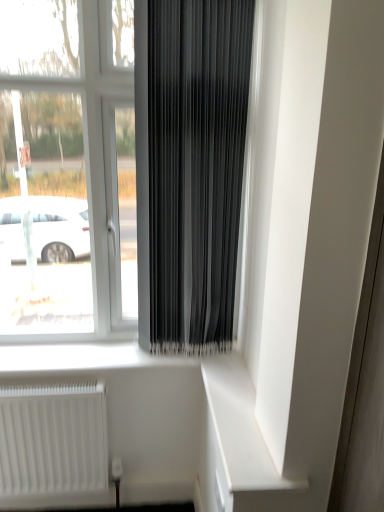
Question: Considering the positions of point (211, 51) and point (119, 224), is point (211, 51) closer or farther from the camera than point (119, 224)?

Choices:
 (A) closer
 (B) farther

Answer: (A)

Question: From their relative heights in the image, would you say black matte curtain at center is taller or shorter than transparent glass window at center?

Choices:
 (A) short
 (B) tall

Answer: (A)

Question: Which of these objects is positioned closest to the black matte curtain at center?

Choices:
 (A) transparent glass window at center
 (B) white matte radiator at lower left
 (C) white matte shelf at lower right

Answer: (A)

Question: Considering the real-world distances, which object is farthest from the black matte curtain at center?

Choices:
 (A) white matte shelf at lower right
 (B) white matte radiator at lower left
 (C) transparent glass window at center

Answer: (B)